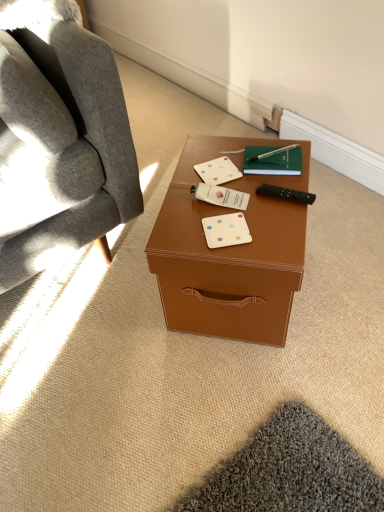
You are a GUI agent. You are given a task and a screenshot of the screen. Output one action in this format:
    pyautogui.click(x=<x>, y=<y>)
    Task: Click on the free space in front of white matte business card at center, the 3th business card when ordered from back to front
    
    Given the screenshot: What is the action you would take?
    pyautogui.click(x=237, y=256)